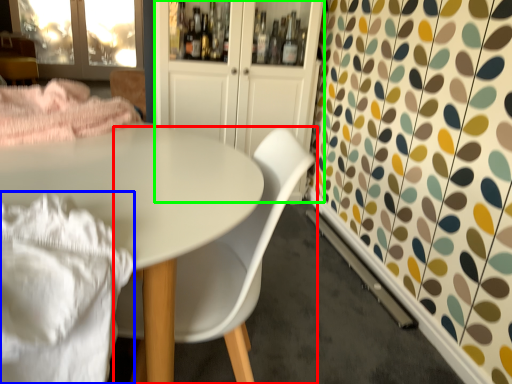
Question: Considering the real-world distances, which object is farthest from chair (highlighted by a red box)? blanket (highlighted by a blue box) or dresser (highlighted by a green box)?

Choices:
 (A) blanket
 (B) dresser

Answer: (B)